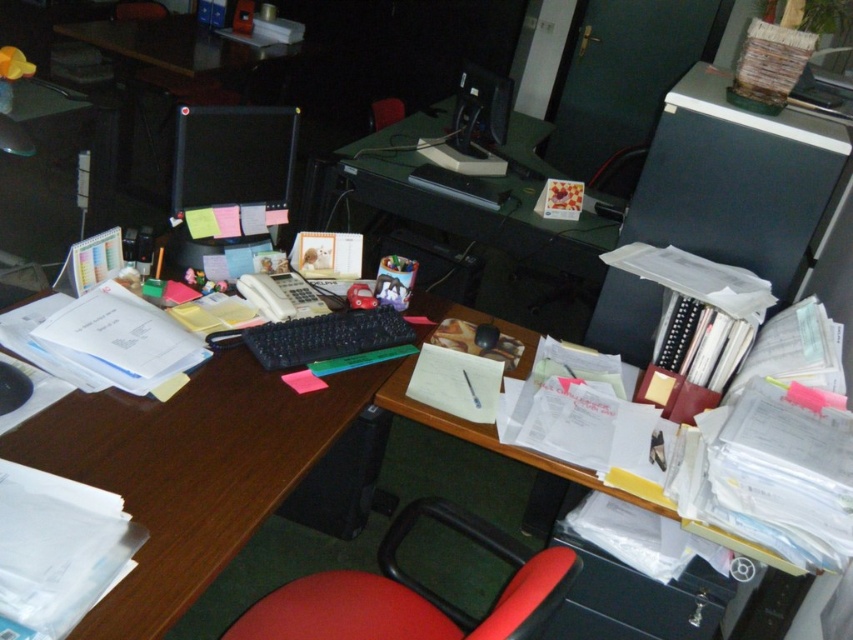
Can you confirm if black plastic file cabinet at right is positioned to the left of red fabric swivel chair at lower center?

Incorrect, black plastic file cabinet at right is not on the left side of red fabric swivel chair at lower center.

Which is behind, point (782, 205) or point (440, 616)?

The point (782, 205) is more distant.

Between point (804, 208) and point (387, 605), which one is positioned in front?

Positioned in front is point (387, 605).

Where is `black plastic file cabinet at right`? Image resolution: width=853 pixels, height=640 pixels. black plastic file cabinet at right is located at coordinates (735, 180).

Which of these two, wooden desk at left or black glossy monitor at upper center, stands shorter?

black glossy monitor at upper center

Is wooden desk at left smaller than black glossy monitor at upper center?

No.

Between point (235, 540) and point (250, 232), which one is positioned behind?

Point (250, 232)

Where is `wooden desk at left`? The width and height of the screenshot is (853, 640). wooden desk at left is located at coordinates (189, 470).

Which is above, wooden desk at left or black plastic file cabinet at right?

black plastic file cabinet at right

Is wooden desk at left shorter than black plastic file cabinet at right?

Indeed, wooden desk at left has a lesser height compared to black plastic file cabinet at right.

I want to click on wooden desk at left, so click(x=189, y=470).

Find the location of a particular element. The height and width of the screenshot is (640, 853). wooden desk at left is located at coordinates (189, 470).